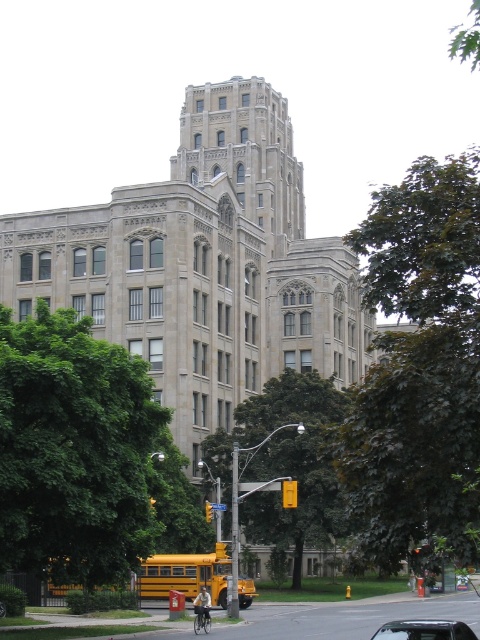
Between green leafy tree at left and yellow matte school bus at lower center, which one is positioned lower?

yellow matte school bus at lower center is lower down.

Can you confirm if green leafy tree at left is smaller than yellow matte school bus at lower center?

Actually, green leafy tree at left might be larger than yellow matte school bus at lower center.

Is point (61, 444) more distant than point (212, 579)?

No, it is in front of (212, 579).

Find the location of a particular element. The width and height of the screenshot is (480, 640). green leafy tree at left is located at coordinates (73, 451).

Which is in front, point (15, 388) or point (226, 474)?

Positioned in front is point (15, 388).

Which is behind, point (75, 394) or point (239, 422)?

The point (239, 422) is behind.

Locate an element on the screen. green leafy tree at left is located at coordinates (73, 451).

Between dark green leafy tree at center and green leafy tree at center, which one is positioned lower?

green leafy tree at center is lower down.

Between dark green leafy tree at center and green leafy tree at center, which one appears on the right side from the viewer's perspective?

From the viewer's perspective, dark green leafy tree at center appears more on the right side.

Find the location of `dark green leafy tree at center`. dark green leafy tree at center is located at coordinates (419, 369).

Locate an element on the screen. The height and width of the screenshot is (640, 480). dark green leafy tree at center is located at coordinates (419, 369).